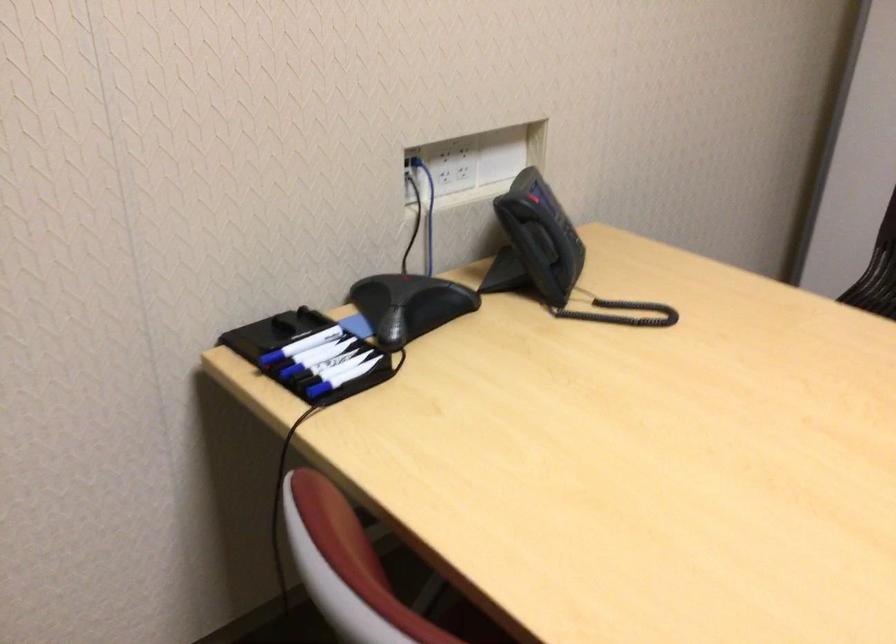
Locate an element on the screen. Image resolution: width=896 pixels, height=644 pixels. conference phone button is located at coordinates (530, 202).